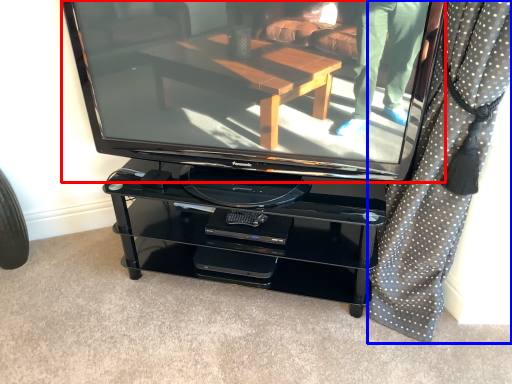
Question: Which of the following is the farthest to the observer, television (highlighted by a red box) or curtain (highlighted by a blue box)?

Choices:
 (A) television
 (B) curtain

Answer: (A)